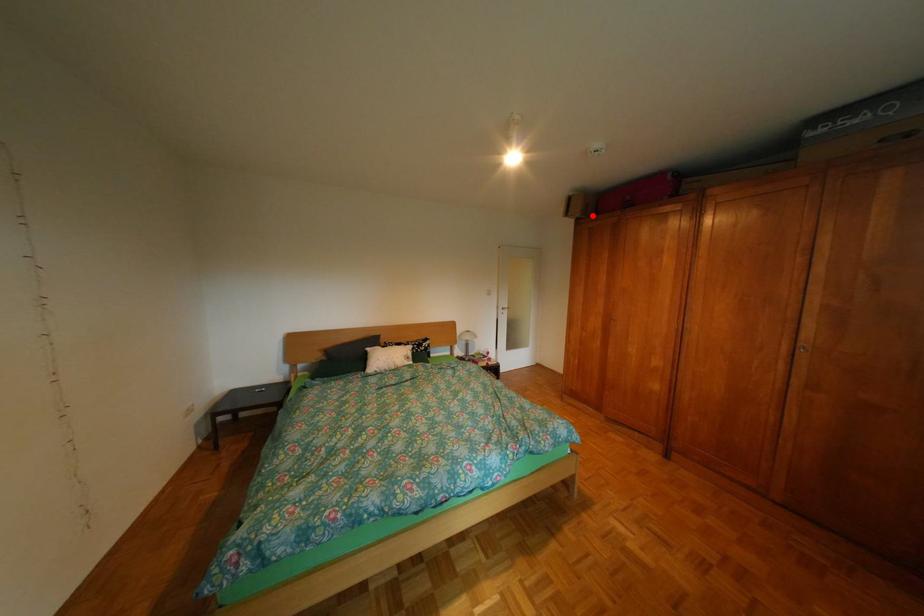
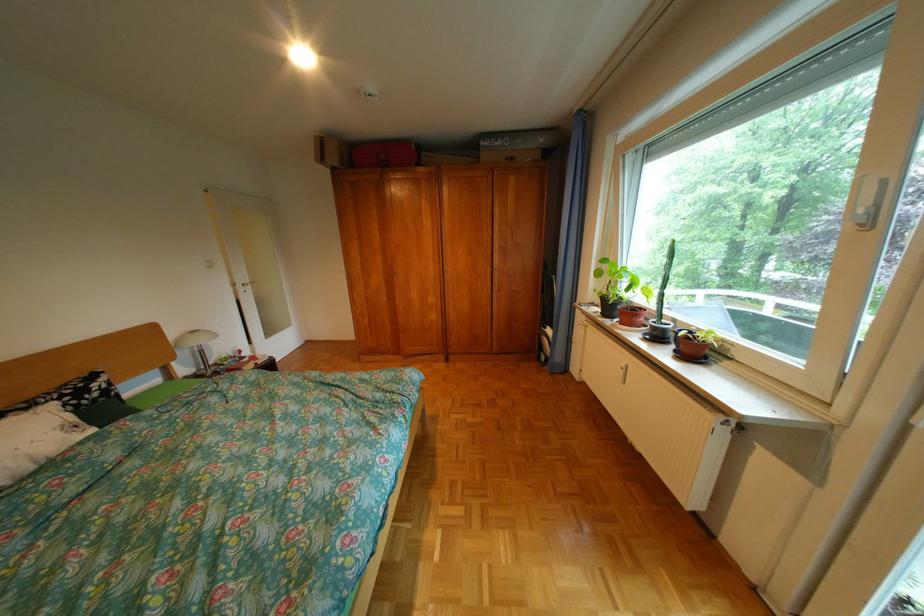
Find the pixel in the second image that matches the highlighted location in the first image.

(350, 164)